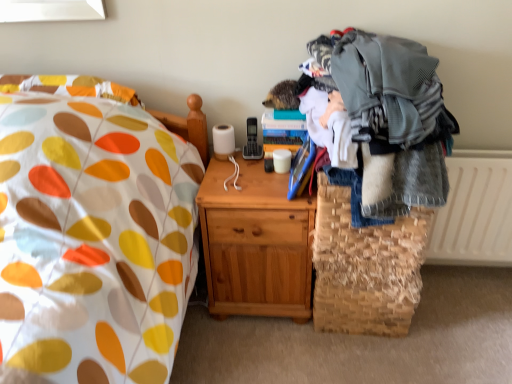
Identify the location of unoccupied area in front of light brown wood nightstand at center. (267, 355).